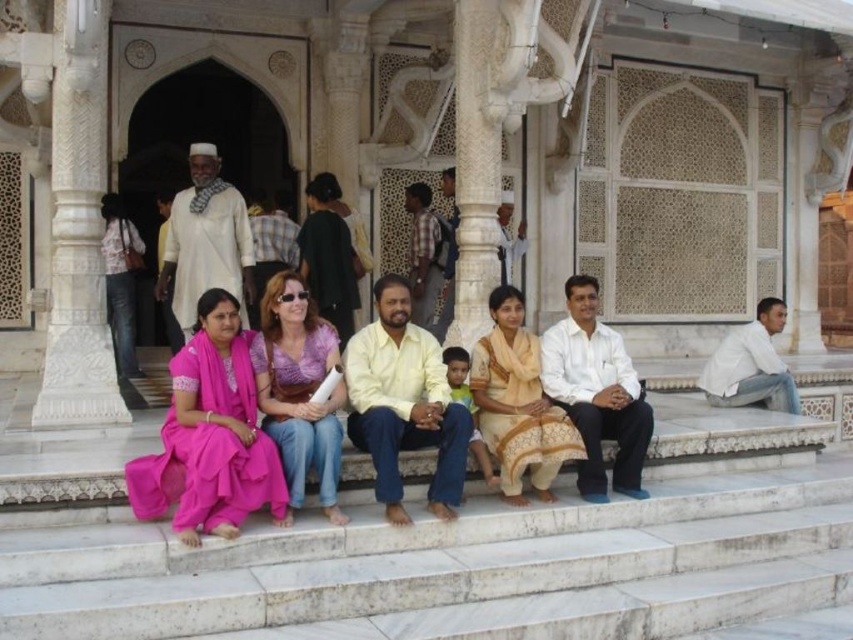
You are standing on the steps of the building and want to take a photo of the purple fabric dress at center and the white cotton shirt at right. Which one is closer to the bottom of the steps?

The purple fabric dress at center is positioned under the white cotton shirt at right, so the purple fabric dress at center is closer to the bottom of the steps.

You are standing in front of the architectural structure and want to take a photo of both the white marble pillar at left and the white cotton shirt at right. Which object should you focus on first to ensure both are in the frame?

You should focus on the white marble pillar at left first since it is closer to you than the white cotton shirt at right, ensuring both are in the frame by adjusting the camera angle accordingly.

You are a photographer trying to capture a closeup of the purple fabric dress at center and the white cotton shirt at right. Which one should you focus on first to ensure it is in sharp focus?

The purple fabric dress at center should be focused on first since it is closer to the viewer than the white cotton shirt at right, ensuring it stays in sharp focus.